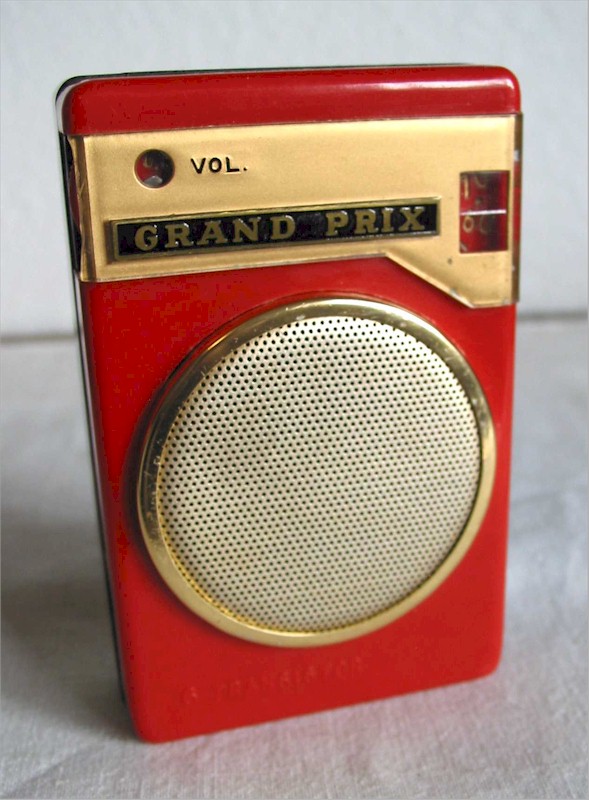
In order to click on counter top in this screenshot , I will do `click(555, 418)`, `click(448, 745)`, `click(33, 538)`.